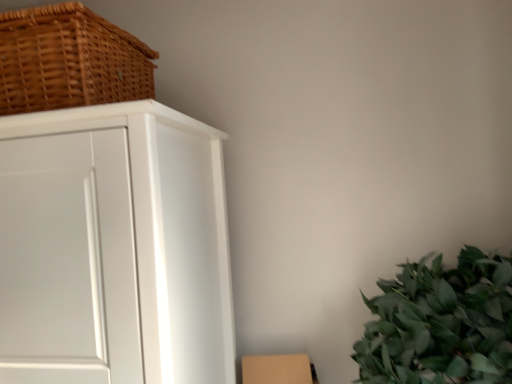
The height and width of the screenshot is (384, 512). What do you see at coordinates (69, 60) in the screenshot?
I see `woven brown basket at upper left` at bounding box center [69, 60].

What do you see at coordinates (150, 228) in the screenshot?
I see `white matte cabinet at left` at bounding box center [150, 228].

You are a GUI agent. You are given a task and a screenshot of the screen. Output one action in this format:
    pyautogui.click(x=<x>, y=<y>)
    Task: Click on the brown cardboard box at lower right
    The image size is (512, 384).
    Given the screenshot: What is the action you would take?
    pyautogui.click(x=278, y=369)

In terms of height, does woven brown basket at upper left look taller or shorter compared to brown cardboard box at lower right?

Clearly, woven brown basket at upper left is shorter compared to brown cardboard box at lower right.

Which of these two, woven brown basket at upper left or brown cardboard box at lower right, is wider?

woven brown basket at upper left is wider.

Is woven brown basket at upper left far from brown cardboard box at lower right?

woven brown basket at upper left is actually quite close to brown cardboard box at lower right.

Is brown cardboard box at lower right completely or partially inside woven brown basket at upper left?

No.

Which of these two, brown cardboard box at lower right or woven brown basket at upper left, stands taller?

brown cardboard box at lower right.

Can woven brown basket at upper left be found inside brown cardboard box at lower right?

No, brown cardboard box at lower right does not contain woven brown basket at upper left.

Considering the relative positions of brown cardboard box at lower right and woven brown basket at upper left in the image provided, is brown cardboard box at lower right to the left or to the right of woven brown basket at upper left?

Clearly, brown cardboard box at lower right is on the right of woven brown basket at upper left in the image.

Can you confirm if woven brown basket at upper left is bigger than white matte cabinet at left?

No.

Is point (41, 24) closer to viewer compared to point (208, 234)?

Yes, it is in front of point (208, 234).

How different are the orientations of woven brown basket at upper left and white matte cabinet at left in degrees?

woven brown basket at upper left and white matte cabinet at left are facing 0.000261 degrees away from each other.

Do you think woven brown basket at upper left is within white matte cabinet at left, or outside of it?

woven brown basket at upper left is spatially situated outside white matte cabinet at left.

Is white matte cabinet at left next to brown cardboard box at lower right and touching it?

white matte cabinet at left and brown cardboard box at lower right are not in contact.

Is white matte cabinet at left turned away from brown cardboard box at lower right?

No, white matte cabinet at left is not facing away from brown cardboard box at lower right.

Is white matte cabinet at left thinner than brown cardboard box at lower right?

No, white matte cabinet at left is not thinner than brown cardboard box at lower right.

Considering the positions of point (227, 333) and point (246, 366), is point (227, 333) closer or farther from the camera than point (246, 366)?

Point (227, 333).

Who is more distant, white matte cabinet at left or woven brown basket at upper left?

Positioned behind is woven brown basket at upper left.

From a real-world perspective, is white matte cabinet at left on woven brown basket at upper left?

No, from a real-world perspective, white matte cabinet at left is not on top of woven brown basket at upper left.

From the image's perspective, is white matte cabinet at left located beneath woven brown basket at upper left?

Yes.

Is white matte cabinet at left oriented towards woven brown basket at upper left?

No, white matte cabinet at left does not turn towards woven brown basket at upper left.

From the image's perspective, who appears lower, brown cardboard box at lower right or white matte cabinet at left?

brown cardboard box at lower right appears lower in the image.

From a real-world perspective, is brown cardboard box at lower right physically below white matte cabinet at left?

Yes, from a real-world perspective, brown cardboard box at lower right is below white matte cabinet at left.

Considering the relative positions of brown cardboard box at lower right and white matte cabinet at left in the image provided, is brown cardboard box at lower right in front of white matte cabinet at left?

No, the depth of brown cardboard box at lower right is greater than that of white matte cabinet at left.

In the scene shown: Can you tell me how much brown cardboard box at lower right and white matte cabinet at left differ in facing direction?

There is a 2.11-degree angle between the facing directions of brown cardboard box at lower right and white matte cabinet at left.

I want to click on cardboard box behind the woven brown basket at upper left, so click(x=278, y=369).

Locate an element on the screen. The width and height of the screenshot is (512, 384). basket in front of the brown cardboard box at lower right is located at coordinates (69, 60).

From the image, which object appears to be nearer to white matte cabinet at left, brown cardboard box at lower right or woven brown basket at upper left?

woven brown basket at upper left lies closer to white matte cabinet at left than the other object.

When comparing their distances from brown cardboard box at lower right, does woven brown basket at upper left or white matte cabinet at left seem further?

woven brown basket at upper left lies further to brown cardboard box at lower right than the other object.

When comparing their distances from white matte cabinet at left, does woven brown basket at upper left or brown cardboard box at lower right seem further?

brown cardboard box at lower right lies further to white matte cabinet at left than the other object.

Estimate the real-world distances between objects in this image. Which object is further from woven brown basket at upper left, white matte cabinet at left or brown cardboard box at lower right?

brown cardboard box at lower right is positioned further to the anchor woven brown basket at upper left.

From the image, which object appears to be nearer to brown cardboard box at lower right, white matte cabinet at left or woven brown basket at upper left?

The object closer to brown cardboard box at lower right is white matte cabinet at left.

Which object lies nearer to the anchor point woven brown basket at upper left, brown cardboard box at lower right or white matte cabinet at left?

white matte cabinet at left is closer to woven brown basket at upper left.

I want to click on cupboard that lies between woven brown basket at upper left and brown cardboard box at lower right from top to bottom, so click(x=150, y=228).